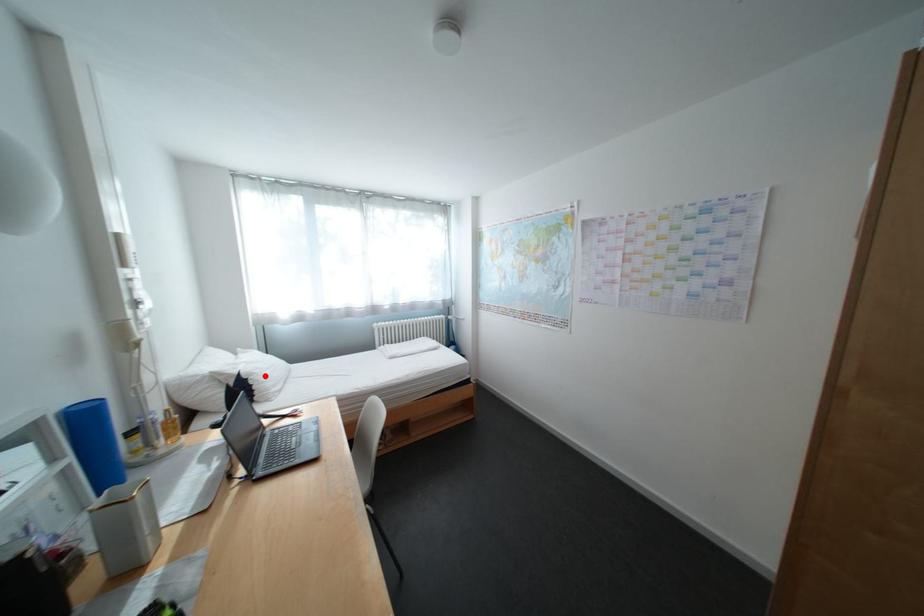
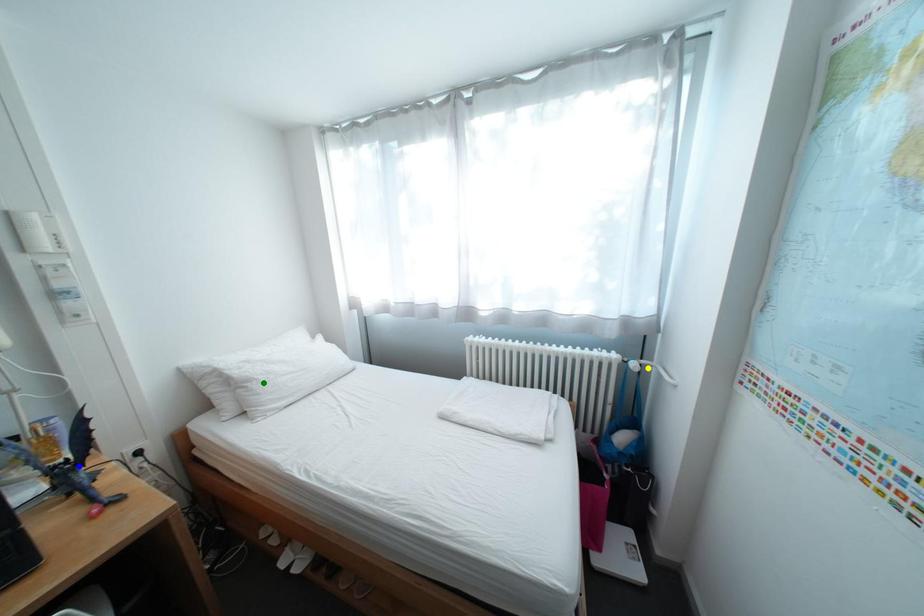
Question: I am providing you with two images of the same scene from different viewpoints. A red point is marked on the first image. You are given multiple points on the second image. Which mark in image 2 goes with the point in image 1?

Choices:
 (A) yellow point
 (B) blue point
 (C) green point

Answer: (C)